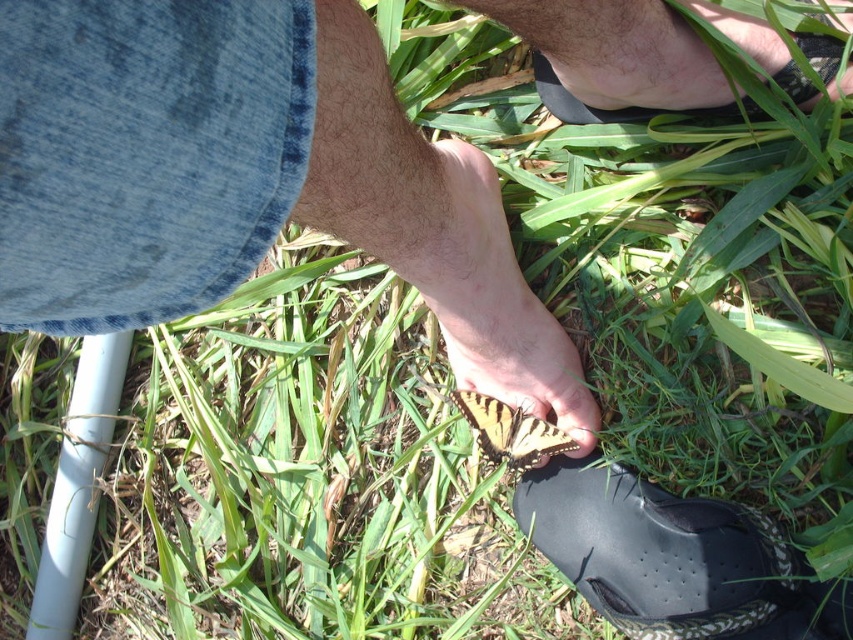
Is point (555, 493) closer to viewer compared to point (450, 317)?

That is False.

Which of these two, black rubber shoe at lower right or yellow-black butterfly at center, stands taller?

With more height is yellow-black butterfly at center.

The image size is (853, 640). What do you see at coordinates (672, 557) in the screenshot?
I see `black rubber shoe at lower right` at bounding box center [672, 557].

Identify the location of black rubber shoe at lower right. Image resolution: width=853 pixels, height=640 pixels. (672, 557).

Who is positioned more to the right, yellow-black butterfly at center or black rubber shoe at upper right?

Positioned to the right is black rubber shoe at upper right.

Which is behind, point (467, 150) or point (549, 86)?

The point (549, 86) is more distant.

Identify the location of yellow-black butterfly at center. (480, 285).

Where is `yellow-black butterfly at center`? The height and width of the screenshot is (640, 853). yellow-black butterfly at center is located at coordinates (480, 285).

Is black rubber shoe at lower right to the left of black rubber shoe at upper right from the viewer's perspective?

Correct, you'll find black rubber shoe at lower right to the left of black rubber shoe at upper right.

Between point (680, 589) and point (730, 104), which one is positioned behind?

The point (730, 104) is behind.

Identify the location of black rubber shoe at lower right. (672, 557).